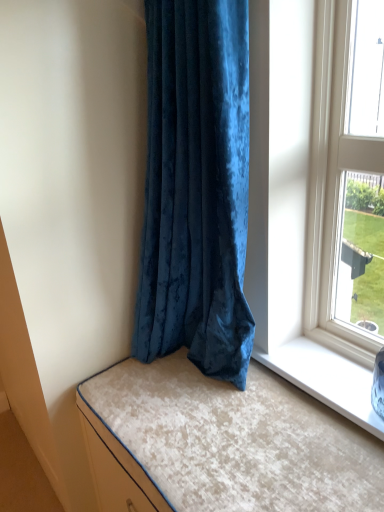
Describe the element at coordinates (196, 188) in the screenshot. The height and width of the screenshot is (512, 384). I see `velvet blue curtain at center` at that location.

The width and height of the screenshot is (384, 512). In order to click on velvet blue curtain at center in this screenshot , I will do (196, 188).

Image resolution: width=384 pixels, height=512 pixels. I want to click on velvet beige cushion at lower left, so click(236, 440).

Based on the photo, measure the distance between point [190,428] and camera.

A distance of 1.18 meters exists between point [190,428] and camera.

What is the approximate width of velvet beige cushion at lower left?

21.87 inches.

What do you see at coordinates (236, 440) in the screenshot?
I see `velvet beige cushion at lower left` at bounding box center [236, 440].

Find the location of a particular element. This screenshot has width=384, height=512. velvet blue curtain at center is located at coordinates (196, 188).

Between velvet blue curtain at center and velvet beige cushion at lower left, which one appears on the left side from the viewer's perspective?

From the viewer's perspective, velvet blue curtain at center appears more on the left side.

Is velvet blue curtain at center further to camera compared to velvet beige cushion at lower left?

Yes, velvet blue curtain at center is further from the viewer.

Considering the points (176, 32) and (295, 444), which point is behind, point (176, 32) or point (295, 444)?

The point (295, 444) is more distant.

From the image's perspective, is velvet blue curtain at center positioned above or below velvet beige cushion at lower left?

velvet blue curtain at center is above velvet beige cushion at lower left.

From a real-world perspective, is velvet blue curtain at center over velvet beige cushion at lower left?

Correct, in the physical world, velvet blue curtain at center is higher than velvet beige cushion at lower left.

Considering the sizes of velvet blue curtain at center and velvet beige cushion at lower left in the image, is velvet blue curtain at center wider or thinner than velvet beige cushion at lower left?

Considering their sizes, velvet blue curtain at center looks slimmer than velvet beige cushion at lower left.

Considering the relative sizes of velvet blue curtain at center and velvet beige cushion at lower left in the image provided, is velvet blue curtain at center shorter than velvet beige cushion at lower left?

No, velvet blue curtain at center is not shorter than velvet beige cushion at lower left.

Can you confirm if velvet blue curtain at center is bigger than velvet beige cushion at lower left?

Yes, velvet blue curtain at center is bigger than velvet beige cushion at lower left.

Is velvet blue curtain at center located outside velvet beige cushion at lower left?

velvet blue curtain at center lies outside velvet beige cushion at lower left's area.

Are velvet blue curtain at center and velvet beige cushion at lower left far apart?

No, there isn't a large distance between velvet blue curtain at center and velvet beige cushion at lower left.

Is velvet blue curtain at center oriented away from velvet beige cushion at lower left?

No.

Where is `curtain on the left of velvet beige cushion at lower left`? curtain on the left of velvet beige cushion at lower left is located at coordinates (196, 188).

In the image, is velvet beige cushion at lower left on the left side or the right side of velvet blue curtain at center?

Based on their positions, velvet beige cushion at lower left is located to the right of velvet blue curtain at center.

Is velvet beige cushion at lower left closer to camera compared to velvet blue curtain at center?

Yes, velvet beige cushion at lower left is in front of velvet blue curtain at center.

Is point (175, 373) positioned after point (179, 289)?

No.

From the image's perspective, which object appears higher, velvet beige cushion at lower left or velvet blue curtain at center?

velvet blue curtain at center is shown above in the image.

From a real-world perspective, is velvet beige cushion at lower left under velvet blue curtain at center?

Indeed, from a real-world perspective, velvet beige cushion at lower left is positioned beneath velvet blue curtain at center.

Is velvet beige cushion at lower left wider than velvet blue curtain at center?

Correct, the width of velvet beige cushion at lower left exceeds that of velvet blue curtain at center.

Is velvet beige cushion at lower left taller than velvet blue curtain at center?

In fact, velvet beige cushion at lower left may be shorter than velvet blue curtain at center.

Can you confirm if velvet beige cushion at lower left is bigger than velvet blue curtain at center?

No, velvet beige cushion at lower left is not bigger than velvet blue curtain at center.

Is velvet beige cushion at lower left positioned beyond the bounds of velvet blue curtain at center?

That's correct, velvet beige cushion at lower left is outside of velvet blue curtain at center.

Is the surface of velvet beige cushion at lower left in direct contact with velvet blue curtain at center?

No, velvet beige cushion at lower left is not with velvet blue curtain at center.

Is velvet beige cushion at lower left looking in the opposite direction of velvet blue curtain at center?

That's not correct — velvet beige cushion at lower left is not looking away from velvet blue curtain at center.

How different are the orientations of velvet beige cushion at lower left and velvet blue curtain at center in degrees?

They differ by 0.214 degrees in their facing directions.

From the picture: How distant is velvet beige cushion at lower left from velvet blue curtain at center?

velvet beige cushion at lower left and velvet blue curtain at center are 15.94 inches apart from each other.

Locate an element on the screen. Image resolution: width=384 pixels, height=512 pixels. curtain on the left of the velvet beige cushion at lower left is located at coordinates (196, 188).

Locate an element on the screen. The height and width of the screenshot is (512, 384). bed below the velvet blue curtain at center (from a real-world perspective) is located at coordinates (236, 440).

Where is `curtain positioned vertically above the velvet beige cushion at lower left (from a real-world perspective)`? curtain positioned vertically above the velvet beige cushion at lower left (from a real-world perspective) is located at coordinates (196, 188).